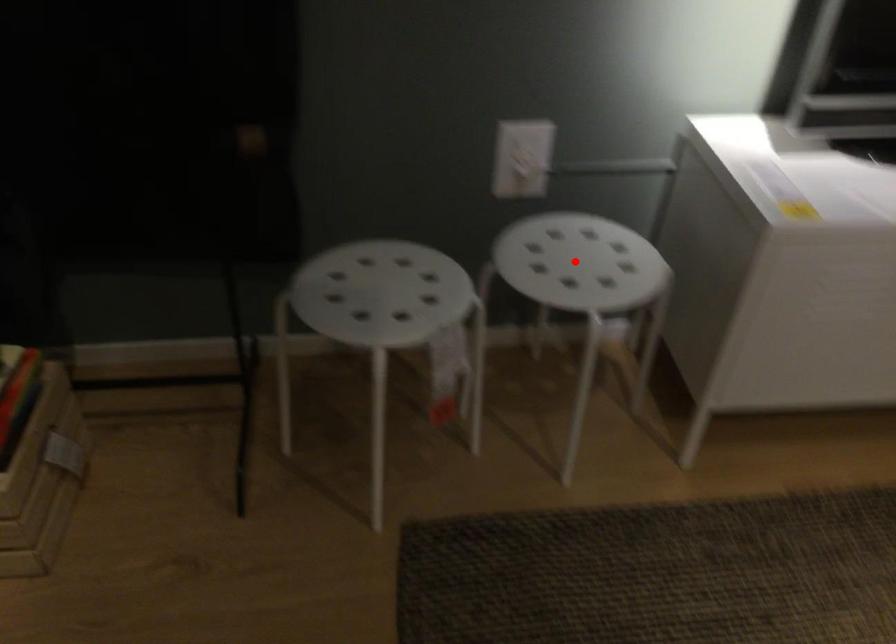
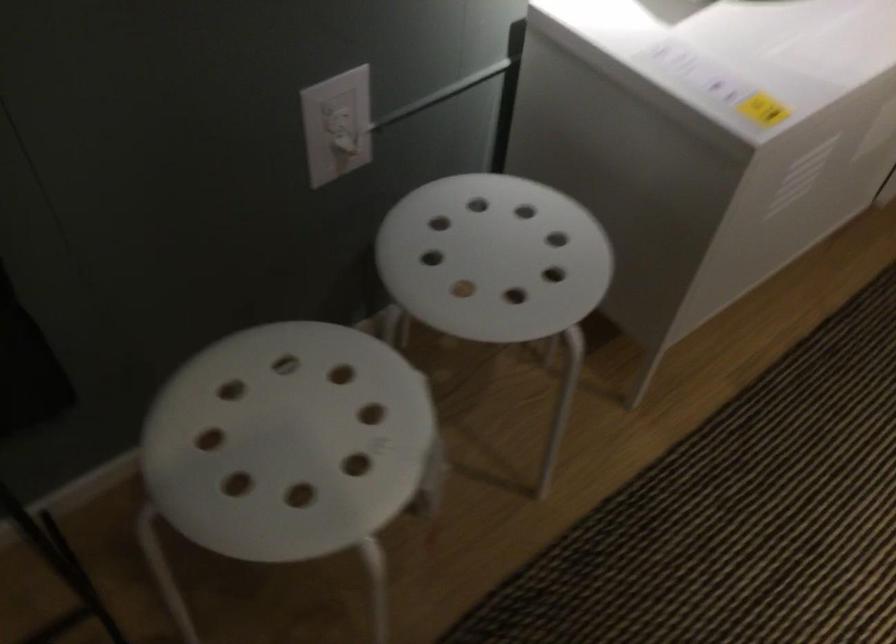
Question: A red point is marked in image1. In image2, is the corresponding 3D point closer to the camera or farther? Reply with the corresponding letter.

Choices:
 (A) The corresponding 3D point is closer.
 (B) The corresponding 3D point is farther.

Answer: (A)